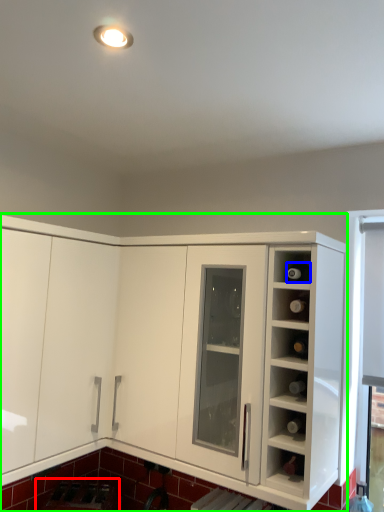
Question: Estimate the real-world distances between objects in this image. Which object is closer to appliance (highlighted by a red box), wine bottle (highlighted by a blue box) or cabinetry (highlighted by a green box)?

Choices:
 (A) wine bottle
 (B) cabinetry

Answer: (B)